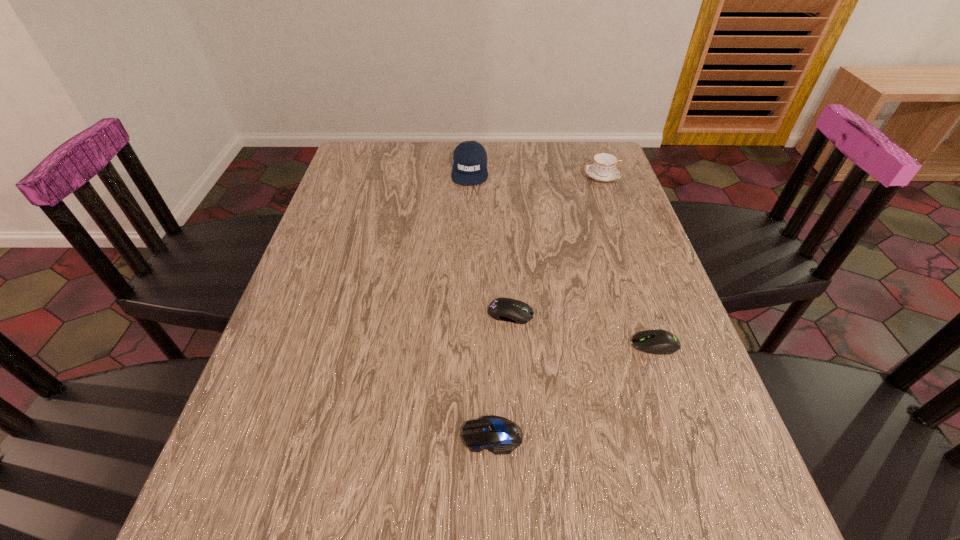
Where is `free space located on the wheel side of the second nearest computer mouse`? free space located on the wheel side of the second nearest computer mouse is located at coordinates (519, 345).

The width and height of the screenshot is (960, 540). What are the coordinates of `vacant space located 0.160m on the button side of the nearest computer mouse` in the screenshot? It's located at (371, 435).

I want to click on vacant area situated on the button side of the nearest computer mouse, so click(233, 435).

I want to click on free location located 0.250m on the button side of the nearest computer mouse, so pos(319,435).

Find the location of a particular element. Image resolution: width=960 pixels, height=540 pixels. baseball cap that is positioned at the far edge is located at coordinates (469, 158).

You are a GUI agent. You are given a task and a screenshot of the screen. Output one action in this format:
    pyautogui.click(x=<x>, y=<y>)
    Task: Click on the teacup situated at the far edge
    
    Given the screenshot: What is the action you would take?
    pyautogui.click(x=603, y=167)

You are a GUI agent. You are given a task and a screenshot of the screen. Output one action in this format:
    pyautogui.click(x=<x>, y=<y>)
    Task: Click on the teacup present at the right edge
    The height and width of the screenshot is (540, 960).
    Given the screenshot: What is the action you would take?
    pyautogui.click(x=603, y=167)

This screenshot has width=960, height=540. I want to click on computer mouse that is at the right edge, so click(x=661, y=342).

At what (x,y) coordinates should I click in order to perform the action: click on object situated at the far right corner. Please return your answer as a coordinate pair (x, y). Looking at the image, I should click on (603, 167).

Image resolution: width=960 pixels, height=540 pixels. I want to click on vacant region at the far edge of the desktop, so click(430, 146).